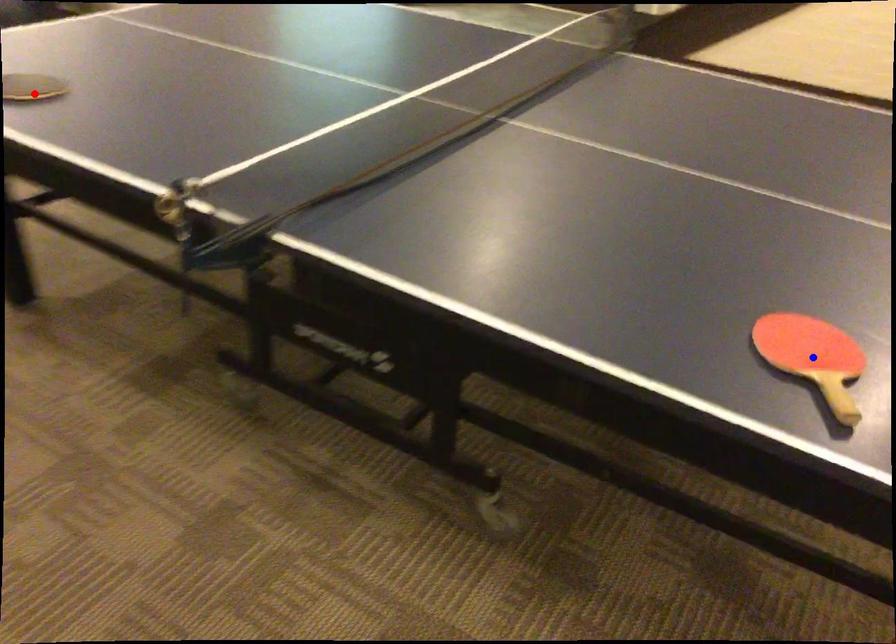
Question: In the image, two points are highlighted. Which point is nearer to the camera? Reply with the corresponding letter.

Choices:
 (A) blue point
 (B) red point

Answer: (A)